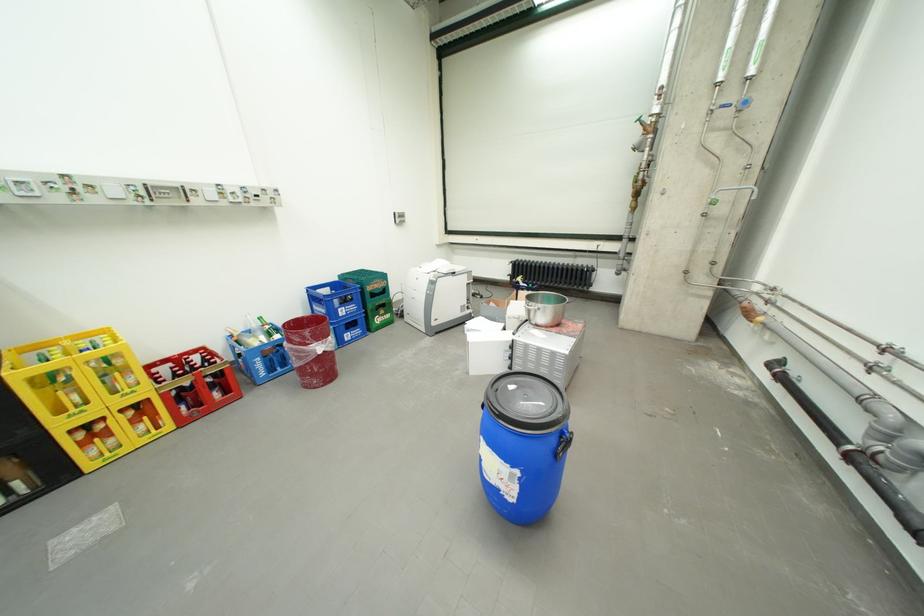
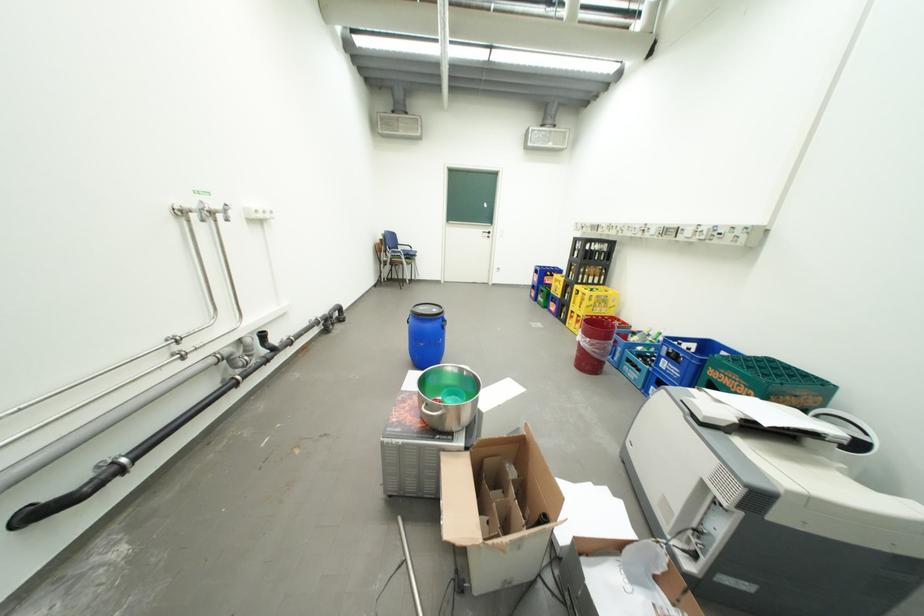
Locate, in the second image, the point that corresponds to the point at 339,339 in the first image.

(599, 341)